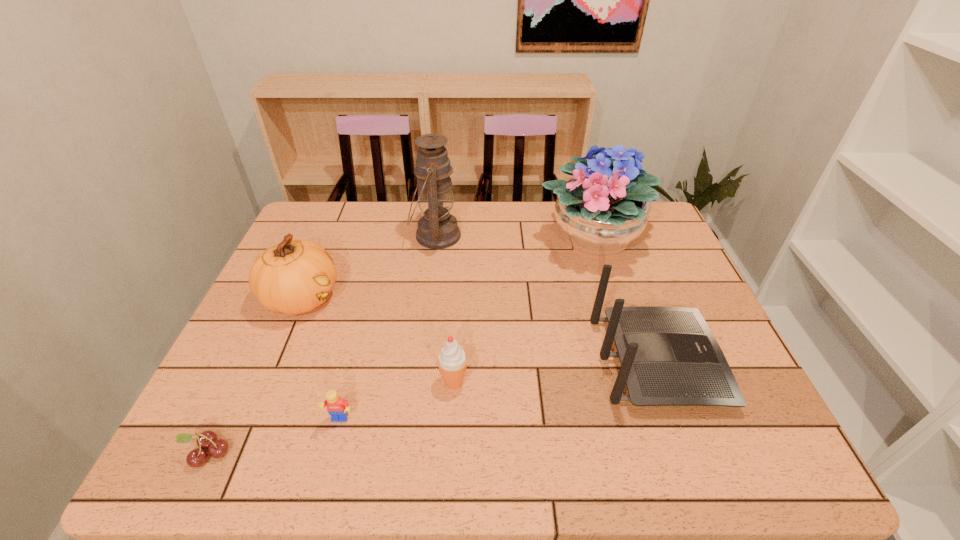
At what (x,y) coordinates should I click in order to perform the action: click on free location located on the left of the sixth shortest object. Please return your answer as a coordinate pair (x, y). Looking at the image, I should click on (492, 239).

In order to click on vacant space situated 0.100m on the front face of the pumpkin in this screenshot , I will do coord(378,298).

Where is `free location located 0.050m on the right of the third shortest object`? The image size is (960, 540). free location located 0.050m on the right of the third shortest object is located at coordinates (491, 382).

Where is `free space located on the face of the sixth tallest object`? free space located on the face of the sixth tallest object is located at coordinates (331, 453).

You are a GUI agent. You are given a task and a screenshot of the screen. Output one action in this format:
    pyautogui.click(x=<x>, y=<y>)
    Task: Click on the oil lamp positioned at the far edge
    
    Given the screenshot: What is the action you would take?
    pyautogui.click(x=438, y=229)

Identify the location of bouquet that is at the far edge. The height and width of the screenshot is (540, 960). (599, 214).

Identify the location of Lego located at the near edge. (337, 408).

Where is `cherry at the near edge`? The image size is (960, 540). cherry at the near edge is located at coordinates (208, 439).

The image size is (960, 540). I want to click on pumpkin present at the left edge, so point(295,276).

The height and width of the screenshot is (540, 960). Identify the location of cherry that is at the left edge. (208, 439).